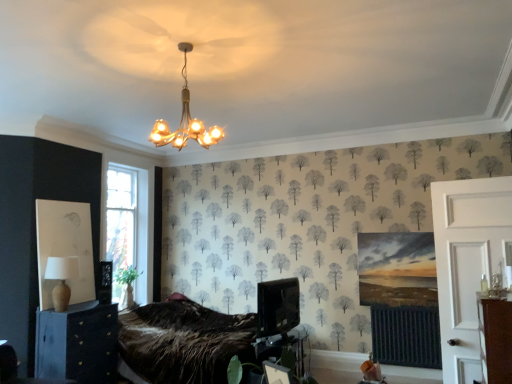
Question: Is metallic silver table at lower center bigger or smaller than matte black cabinet at lower left?

Choices:
 (A) big
 (B) small

Answer: (B)

Question: Looking at their shapes, would you say metallic silver table at lower center is wider or thinner than matte black cabinet at lower left?

Choices:
 (A) wide
 (B) thin

Answer: (B)

Question: Based on their relative distances, which object is farther from the beige fabric lampshade at lower left?

Choices:
 (A) gold metallic chandelier at upper center
 (B) white wooden door at right
 (C) matte black cabinet at lower left
 (D) metallic silver table at lower center

Answer: (B)

Question: Estimate the real-world distances between objects in this image. Which object is farther from the beige fabric lampshade at lower left?

Choices:
 (A) metallic silver table at lower center
 (B) matte black cabinet at lower left
 (C) white wooden door at right
 (D) gold metallic chandelier at upper center

Answer: (C)